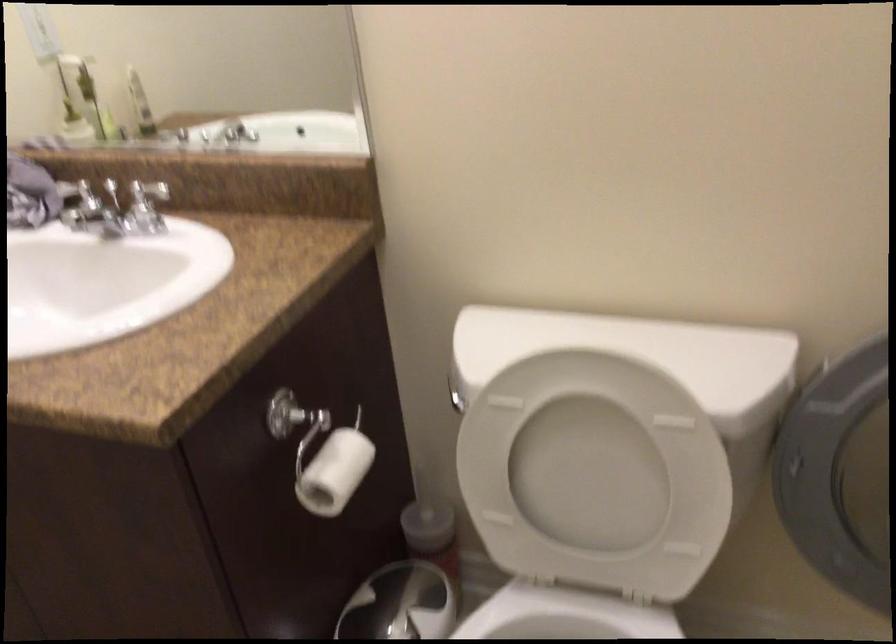
Where is `toilet flush handle`? The height and width of the screenshot is (644, 896). toilet flush handle is located at coordinates (455, 398).